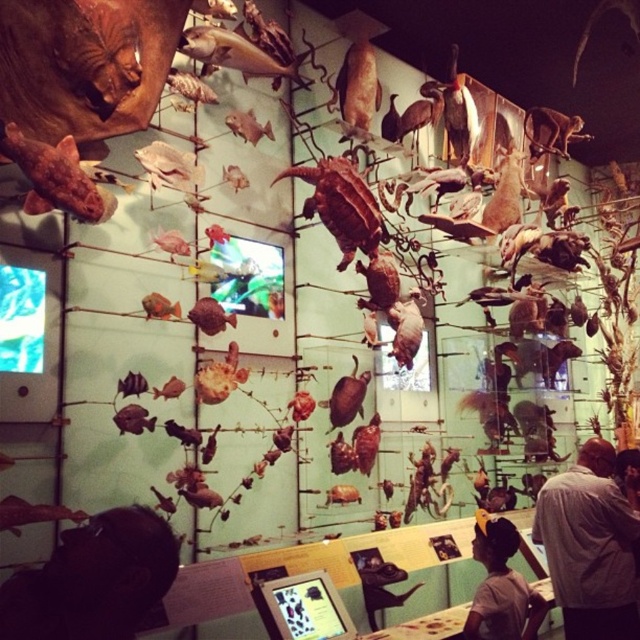
Can you confirm if matte brown fish at upper left is positioned below brown matte turtle at center?

Indeed, matte brown fish at upper left is positioned under brown matte turtle at center.

Does matte brown fish at upper left have a greater height compared to brown matte turtle at center?

No, matte brown fish at upper left is not taller than brown matte turtle at center.

In order to click on matte brown fish at upper left in this screenshot , I will do `click(54, 177)`.

Where is `matte brown fish at upper left`? The height and width of the screenshot is (640, 640). matte brown fish at upper left is located at coordinates (54, 177).

Is gray shirt at lower right to the left of matte brown fish at upper left from the viewer's perspective?

In fact, gray shirt at lower right is to the right of matte brown fish at upper left.

At what (x,y) coordinates should I click in order to perform the action: click on gray shirt at lower right. Please return your answer as a coordinate pair (x, y). Looking at the image, I should click on (589, 545).

Locate an element on the screen. gray shirt at lower right is located at coordinates (589, 545).

Is gray shirt at lower right smaller than dark brown hair at lower center?

Incorrect, gray shirt at lower right is not smaller in size than dark brown hair at lower center.

Image resolution: width=640 pixels, height=640 pixels. I want to click on gray shirt at lower right, so click(589, 545).